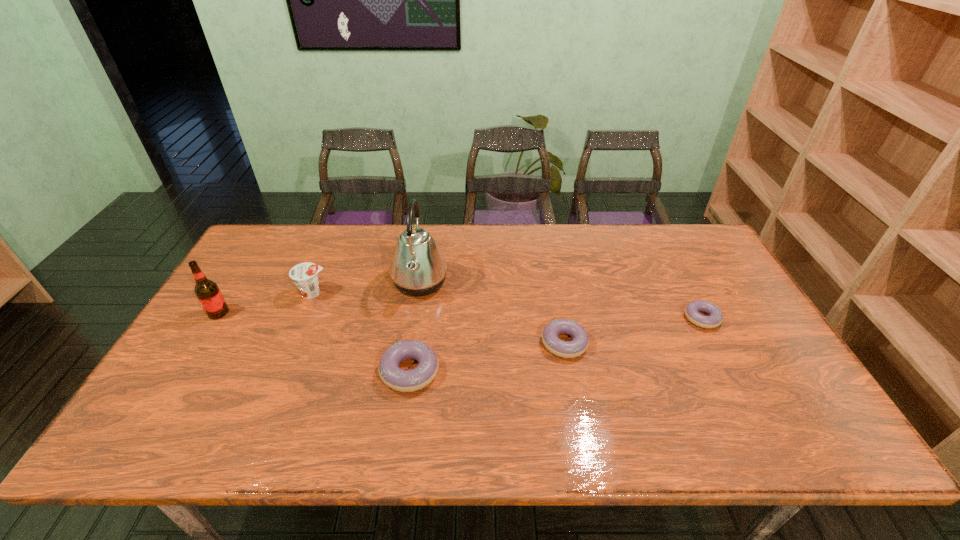
This screenshot has width=960, height=540. I want to click on blank space that satisfies the following two spatial constraints: 1. on the front side of the leftmost doughnut; 2. on the left side of the leftmost object, so click(182, 371).

You are a GUI agent. You are given a task and a screenshot of the screen. Output one action in this format:
    pyautogui.click(x=<x>, y=<y>)
    Task: Click on the free space in the image that satisfies the following two spatial constraints: 1. on the back side of the second shortest object; 2. from the spout of the tallest object
    
    Given the screenshot: What is the action you would take?
    pyautogui.click(x=553, y=282)

Identify the location of vacant area that satisfies the following two spatial constraints: 1. from the spout of the kettle; 2. on the front side of the second tallest object. (415, 313).

You are a GUI agent. You are given a task and a screenshot of the screen. Output one action in this format:
    pyautogui.click(x=<x>, y=<y>)
    Task: Click on the vacant space that satisfies the following two spatial constraints: 1. from the spout of the tallest object; 2. on the right side of the shortest object
    
    Given the screenshot: What is the action you would take?
    pyautogui.click(x=414, y=318)

Locate an element on the screen. vacant space that satisfies the following two spatial constraints: 1. on the front side of the shortest doughnut; 2. on the right side of the fifth object from right to left is located at coordinates (302, 318).

This screenshot has height=540, width=960. Identify the location of vacant point that satisfies the following two spatial constraints: 1. from the spout of the kettle; 2. on the right side of the shortest object. click(414, 318).

Locate an element on the screen. free space that satisfies the following two spatial constraints: 1. from the spout of the kettle; 2. on the back side of the second shortest object is located at coordinates (410, 343).

I want to click on free space in the image that satisfies the following two spatial constraints: 1. from the spout of the kettle; 2. on the back side of the second shortest object, so click(410, 343).

Find the location of a particular element. This screenshot has width=960, height=540. free space that satisfies the following two spatial constraints: 1. from the spout of the leftmost doughnut; 2. on the left side of the tallest object is located at coordinates (406, 371).

Find the location of a particular element. The height and width of the screenshot is (540, 960). blank area in the image that satisfies the following two spatial constraints: 1. from the spout of the tallest object; 2. on the right side of the rightmost doughnut is located at coordinates (414, 318).